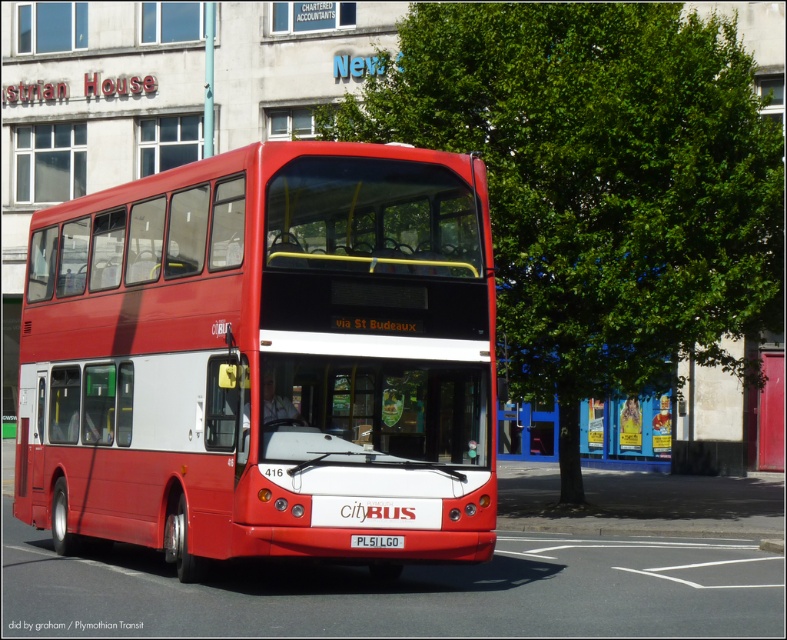
Question: Which point is closer to the camera?

Choices:
 (A) (608, 465)
 (B) (394, 540)

Answer: (B)

Question: Is blue painted metal bus stop at center to the left of white plastic license plate at center from the viewer's perspective?

Choices:
 (A) yes
 (B) no

Answer: (B)

Question: Which point is closer to the camera taking this photo?

Choices:
 (A) (366, 541)
 (B) (74, 440)

Answer: (A)

Question: Does shiny red bus at center appear under white plastic license plate at center?

Choices:
 (A) no
 (B) yes

Answer: (A)

Question: Which object is farther from the camera taking this photo?

Choices:
 (A) blue painted metal bus stop at center
 (B) white plastic license plate at center

Answer: (A)

Question: Is blue painted metal bus stop at center thinner than white plastic license plate at center?

Choices:
 (A) yes
 (B) no

Answer: (B)